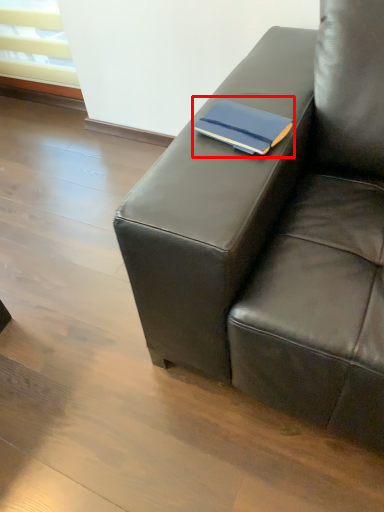
Question: From the image's perspective, where is paperback book (annotated by the red box) located in relation to studio couch in the image?

Choices:
 (A) above
 (B) below

Answer: (A)